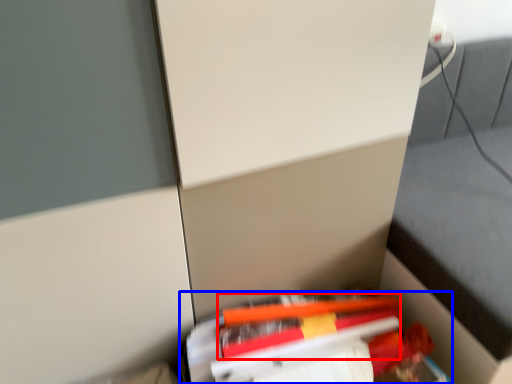
Question: Which of the following is the closest to the observer, pencil (highlighted by a red box) or book (highlighted by a blue box)?

Choices:
 (A) pencil
 (B) book

Answer: (B)